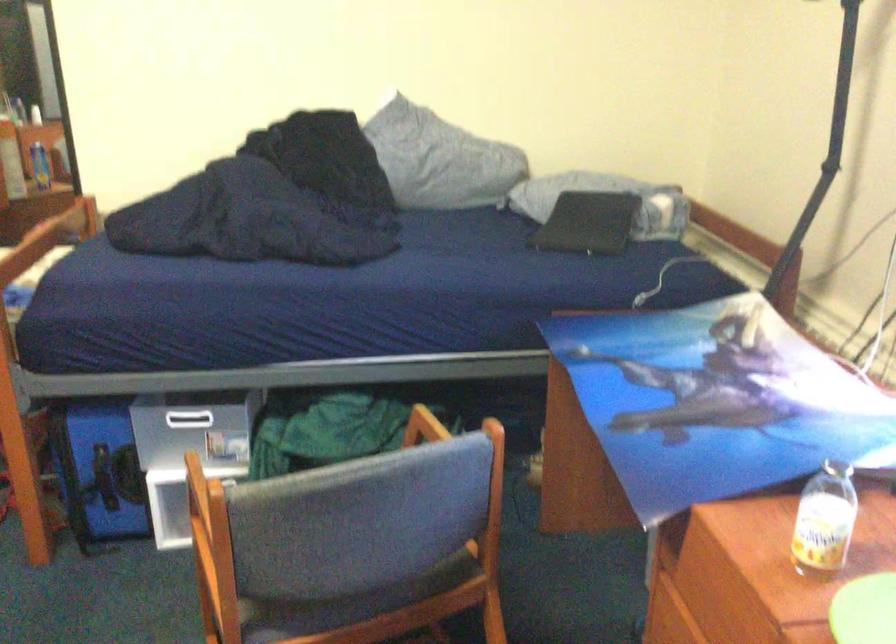
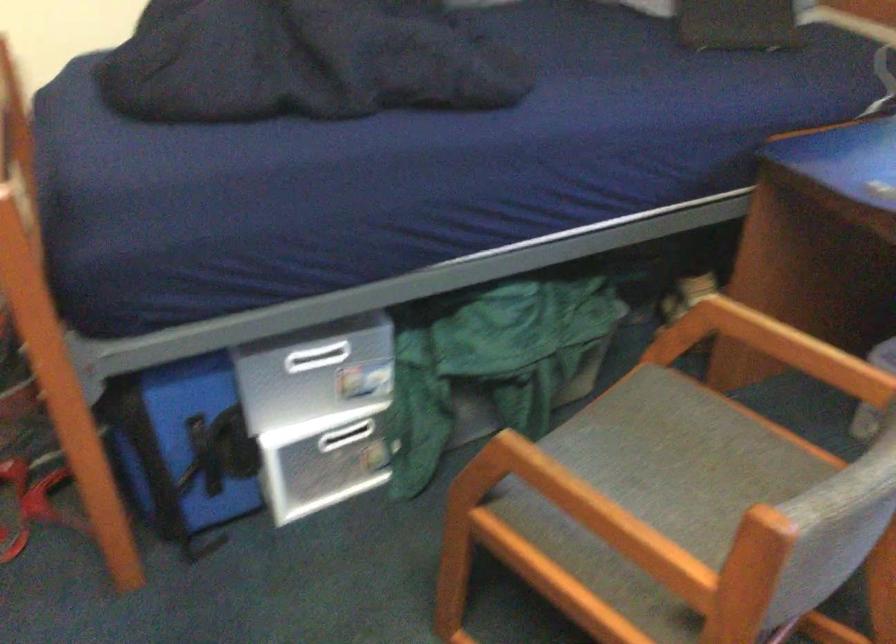
Locate, in the second image, the point that corresponds to (x=197, y=420) in the first image.

(326, 355)